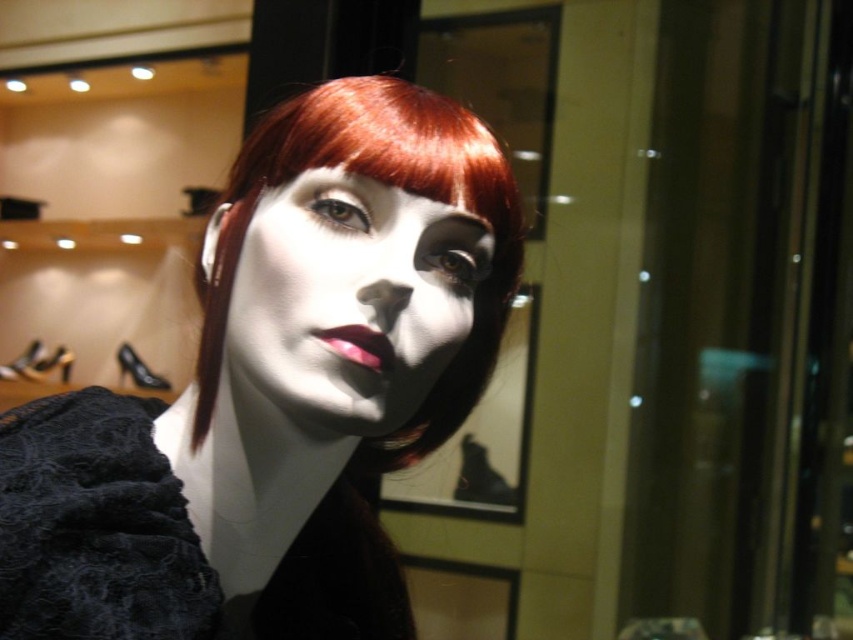
Who is taller, matte black wig at center or lace fabric dress at center?

Standing taller between the two is matte black wig at center.

Does matte black wig at center come in front of lace fabric dress at center?

Yes, it is in front of lace fabric dress at center.

In the scene shown: Who is more forward, (x=310, y=144) or (x=82, y=426)?

Point (x=310, y=144)

Find the location of a particular element. matte black wig at center is located at coordinates (276, 390).

Does matte white face at center appear on the right side of matte pink lipstick at center?

In fact, matte white face at center is to the left of matte pink lipstick at center.

Is matte white face at center bigger than matte pink lipstick at center?

Yes, matte white face at center is bigger than matte pink lipstick at center.

The height and width of the screenshot is (640, 853). Find the location of `matte white face at center`. matte white face at center is located at coordinates pos(352,300).

Is point (292, 547) closer to viewer compared to point (360, 362)?

No.

Between lace fabric dress at center and matte pink lipstick at center, which one appears on the right side from the viewer's perspective?

matte pink lipstick at center is more to the right.

At what (x,y) coordinates should I click in order to perform the action: click on lace fabric dress at center. Please return your answer as a coordinate pair (x, y). This screenshot has width=853, height=640. Looking at the image, I should click on (97, 525).